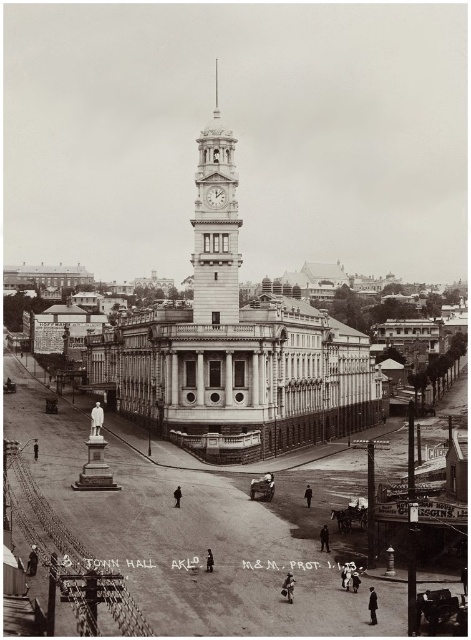
Does smooth stone statue at center have a smaller size compared to white stone clock tower at center?

No, smooth stone statue at center is not smaller than white stone clock tower at center.

Is smooth stone statue at center shorter than white stone clock tower at center?

Indeed, smooth stone statue at center has a lesser height compared to white stone clock tower at center.

This screenshot has width=471, height=640. What do you see at coordinates (213, 477) in the screenshot?
I see `smooth stone statue at center` at bounding box center [213, 477].

At what (x,y) coordinates should I click in order to perform the action: click on smooth stone statue at center. Please return your answer as a coordinate pair (x, y). The width and height of the screenshot is (471, 640). Looking at the image, I should click on (213, 477).

Looking at this image, can you confirm if smooth stone statue at center is smaller than silver metallic spire at upper center?

No, smooth stone statue at center is not smaller than silver metallic spire at upper center.

Is point (159, 538) closer to camera compared to point (217, 76)?

Yes, it is.

At what (x,y) coordinates should I click in order to perform the action: click on smooth stone statue at center. Please return your answer as a coordinate pair (x, y). Looking at the image, I should click on (213, 477).

Is white marble clock at upper center shorter than silver metallic spire at upper center?

Correct, white marble clock at upper center is not as tall as silver metallic spire at upper center.

Which is in front, point (213, 200) or point (213, 113)?

Point (213, 200)

Is point (217, 188) farther from viewer compared to point (217, 96)?

No, (217, 188) is closer to viewer.

Image resolution: width=471 pixels, height=640 pixels. In order to click on white marble clock at upper center in this screenshot , I will do `click(216, 196)`.